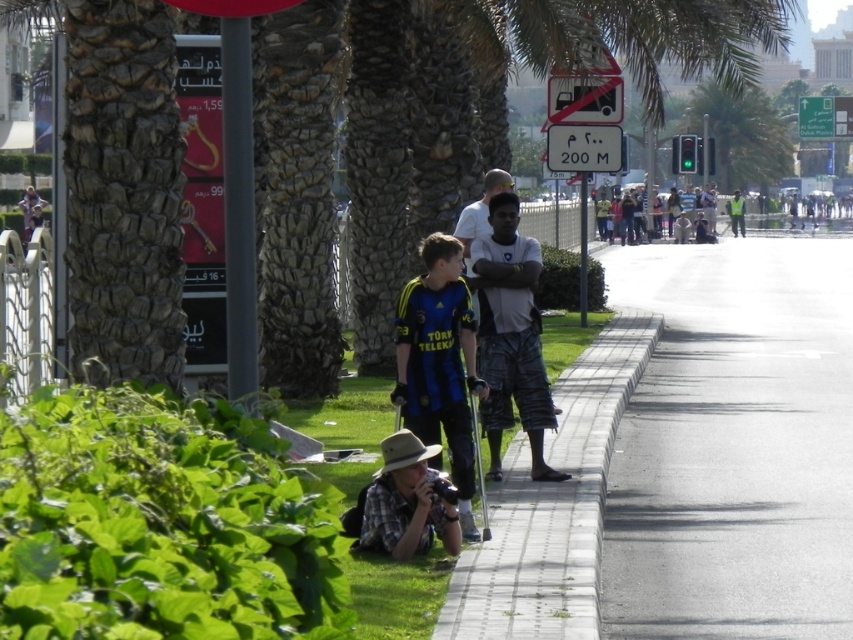
Question: Estimate the real-world distances between objects in this image. Which object is closer to the camouflage pants at center?

Choices:
 (A) light brown shorts at center
 (B) white plastic sign at upper center
 (C) gray concrete pavement at center

Answer: (A)

Question: Is green leafy palm tree at center wider than white plastic sign at upper center?

Choices:
 (A) yes
 (B) no

Answer: (A)

Question: Is brown textured palm tree at center below camouflage pants at center?

Choices:
 (A) yes
 (B) no

Answer: (B)

Question: Which is nearer to the light brown shorts at center?

Choices:
 (A) white plastic sign at upper center
 (B) gray concrete pavement at center
 (C) green leafy palm tree at center
 (D) gray concrete curb at lower center

Answer: (D)

Question: Among these points, which one is farthest from the camera?

Choices:
 (A) (560, 145)
 (B) (668, 339)
 (C) (15, 8)
 (D) (471, 214)

Answer: (C)

Question: Is brown textured palm tree at center positioned before camouflage pants at center?

Choices:
 (A) no
 (B) yes

Answer: (B)